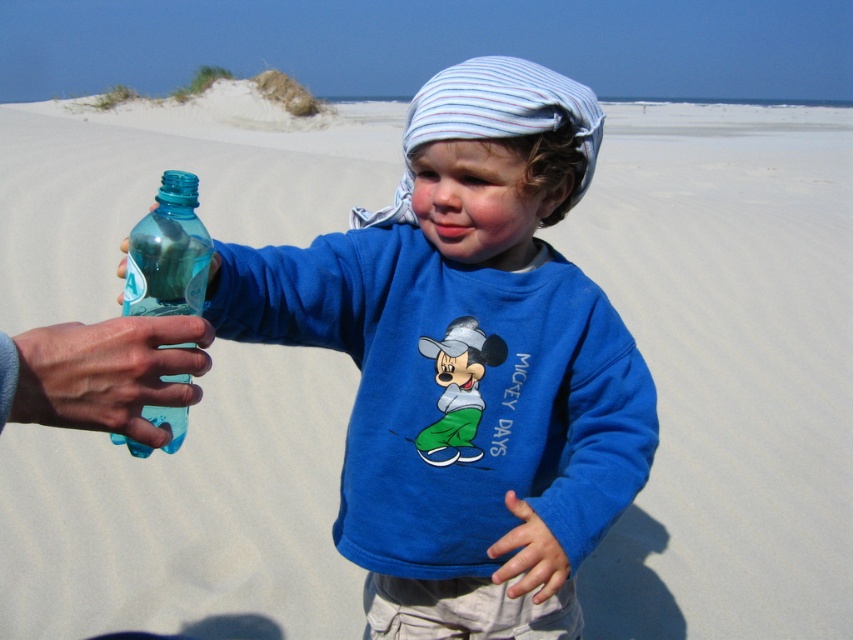
Who is more distant from viewer, (180, 289) or (210, 282)?

Positioned behind is point (210, 282).

Which is above, translucent plastic bottle at left or transparent plastic bottle at left?

transparent plastic bottle at left is higher up.

The width and height of the screenshot is (853, 640). Find the location of `translucent plastic bottle at left`. translucent plastic bottle at left is located at coordinates (167, 253).

This screenshot has width=853, height=640. What are the coordinates of `translucent plastic bottle at left` in the screenshot? It's located at (167, 253).

Which is in front, point (164, 348) or point (219, 257)?

Point (164, 348) is in front.

Describe the element at coordinates (107, 372) in the screenshot. Image resolution: width=853 pixels, height=640 pixels. I see `translucent plastic hand at lower left` at that location.

Identify the location of translucent plastic hand at lower left. (107, 372).

Does point (77, 397) come in front of point (148, 298)?

Yes, it is.

Who is lower down, translucent plastic hand at lower left or translucent plastic bottle at left?

translucent plastic hand at lower left is below.

This screenshot has height=640, width=853. What are the coordinates of `translucent plastic hand at lower left` in the screenshot? It's located at (107, 372).